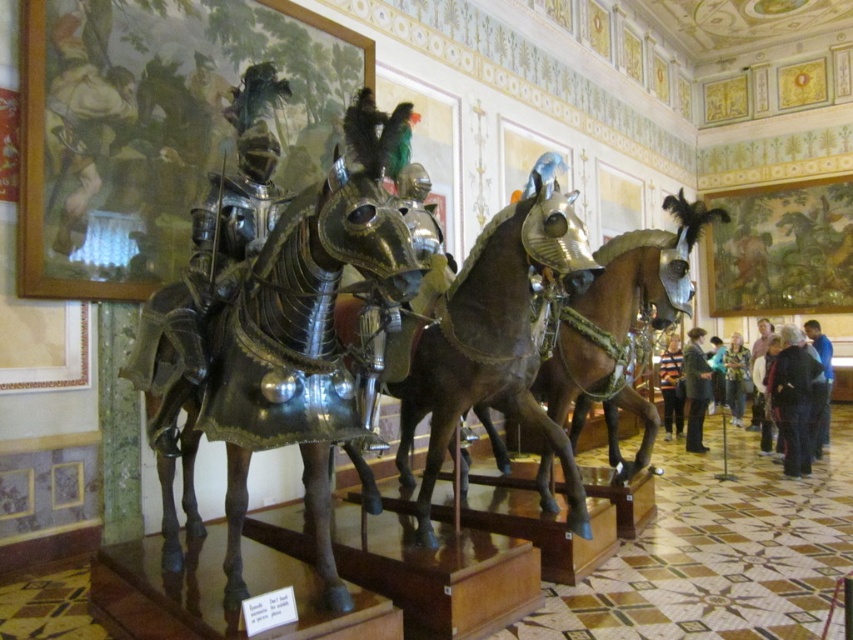
Question: Is dark blue shirt at lower right positioned behind blue fabric shirt at center?

Choices:
 (A) yes
 (B) no

Answer: (B)

Question: From the image, what is the correct spatial relationship of striped shirt at center in relation to dark blue shirt at lower right?

Choices:
 (A) above
 (B) below

Answer: (B)

Question: Which object appears closest to the camera in this image?

Choices:
 (A) dark blue shirt at lower right
 (B) dark brown leather coat at lower right
 (C) shiny silver horse at center
 (D) blue-green fabric jacket at center-right

Answer: (C)

Question: Which object is the closest to the dark brown leather coat at lower right?

Choices:
 (A) shiny silver horse at center
 (B) polished metal horse at center
 (C) striped shirt at center
 (D) blue fabric shirt at center

Answer: (C)

Question: Does dark brown leather coat at lower right have a greater width compared to dark blue shirt at lower right?

Choices:
 (A) yes
 (B) no

Answer: (B)

Question: Which point is closer to the camera taking this photo?

Choices:
 (A) (741, 378)
 (B) (759, 326)
 (C) (560, 332)
 (D) (241, 352)

Answer: (D)